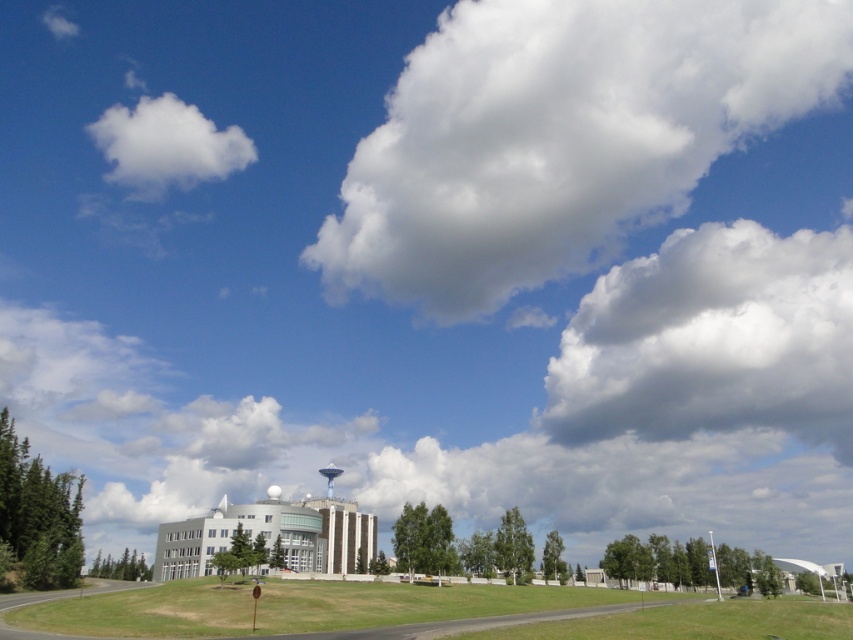
Who is taller, white fluffy cloud at upper right or white fluffy cloud at upper left?

white fluffy cloud at upper right

Where is `white fluffy cloud at upper right`? Image resolution: width=853 pixels, height=640 pixels. white fluffy cloud at upper right is located at coordinates (712, 340).

The height and width of the screenshot is (640, 853). I want to click on white fluffy cloud at upper right, so click(712, 340).

Is white fluffy cloud at upper center closer to camera compared to white fluffy cloud at upper right?

Yes, white fluffy cloud at upper center is in front of white fluffy cloud at upper right.

Which is behind, point (618, 140) or point (590, 440)?

Positioned behind is point (618, 140).

Where is `white fluffy cloud at upper center`? white fluffy cloud at upper center is located at coordinates (560, 138).

Can you confirm if white fluffy cloud at upper center is positioned to the left of white fluffy cloud at upper left?

In fact, white fluffy cloud at upper center is to the right of white fluffy cloud at upper left.

Between point (502, 140) and point (149, 112), which one is positioned in front?

Point (502, 140) is in front.

You are a GUI agent. You are given a task and a screenshot of the screen. Output one action in this format:
    pyautogui.click(x=<x>, y=<y>)
    Task: Click on the white fluffy cloud at upper center
    The height and width of the screenshot is (640, 853).
    Given the screenshot: What is the action you would take?
    pyautogui.click(x=560, y=138)